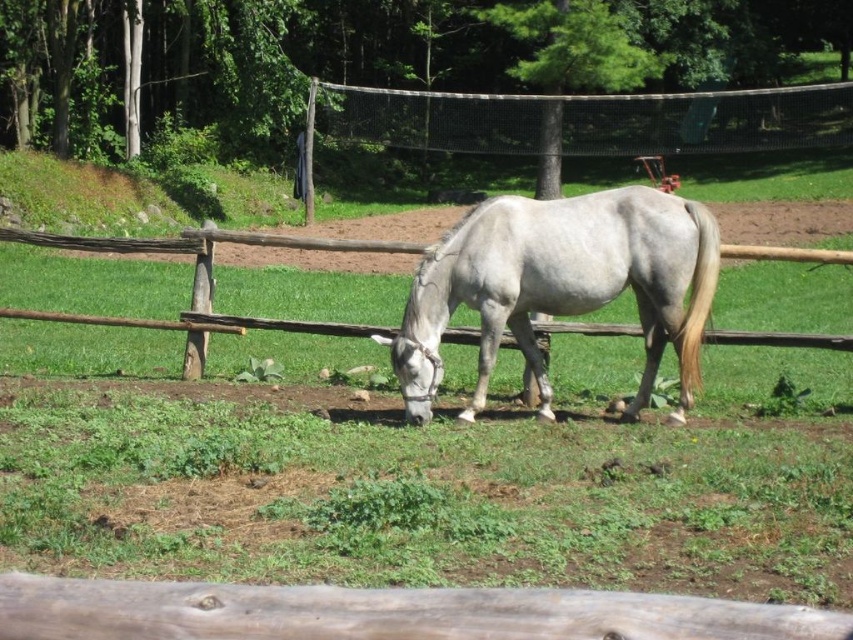
Is white matte horse at center wider than black mesh fence at upper center?

No.

Can you confirm if white matte horse at center is taller than black mesh fence at upper center?

Incorrect, white matte horse at center's height is not larger of black mesh fence at upper center's.

This screenshot has width=853, height=640. In order to click on white matte horse at center in this screenshot , I will do `click(561, 284)`.